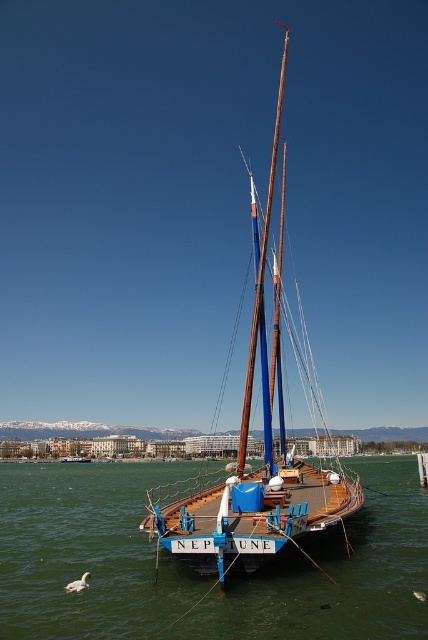
Can you confirm if greenish water at center is positioned to the left of brown wooden mast at center?

Indeed, greenish water at center is positioned on the left side of brown wooden mast at center.

Identify the location of greenish water at center. (195, 573).

Who is more distant from viewer, (x=32, y=570) or (x=258, y=289)?

The point (x=258, y=289) is behind.

Find the location of a particular element. The width and height of the screenshot is (428, 640). greenish water at center is located at coordinates pos(195,573).

Is wooden sailboat at center positioned before brown wooden mast at center?

Yes, wooden sailboat at center is closer to the viewer.

Is point (250, 508) positioned after point (264, 412)?

No, it is in front of (264, 412).

The width and height of the screenshot is (428, 640). What are the coordinates of `wooden sailboat at center` in the screenshot? It's located at (246, 451).

Does greenish water at center appear over wooden sailboat at center?

Actually, greenish water at center is below wooden sailboat at center.

Identify the location of greenish water at center. Image resolution: width=428 pixels, height=640 pixels. coord(195,573).

Between point (94, 582) and point (175, 508), which one is positioned behind?

Positioned behind is point (175, 508).

This screenshot has height=640, width=428. In order to click on greenish water at center in this screenshot , I will do `click(195, 573)`.